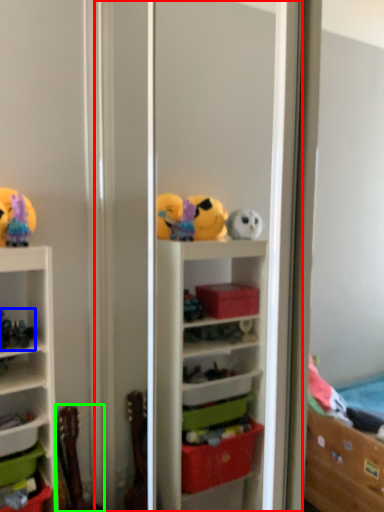
Question: Which object is the closest to the screen door (highlighted by a red box)? Choose among these: toy (highlighted by a blue box) or toy (highlighted by a green box).

Choices:
 (A) toy
 (B) toy

Answer: (B)